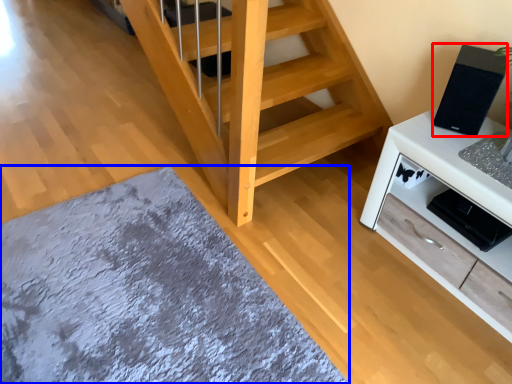
Question: Which object is closer to the camera taking this photo, appliance (highlighted by a red box) or mat (highlighted by a blue box)?

Choices:
 (A) appliance
 (B) mat

Answer: (B)